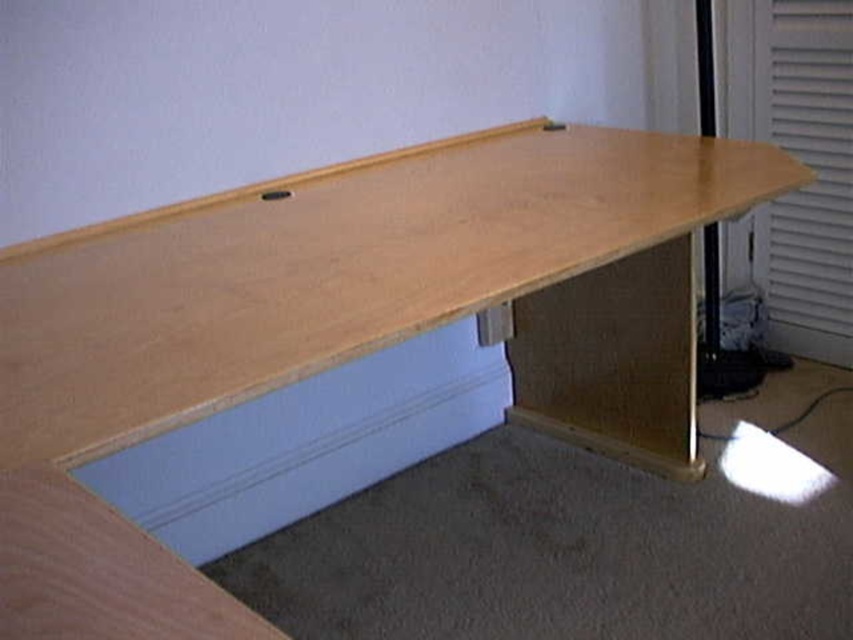
Locate an element on the screen. The image size is (853, 640). light blue plastic drawer at lower center is located at coordinates (305, 444).

Is light blue plastic drawer at lower center to the right of white textured blind at right from the viewer's perspective?

Incorrect, light blue plastic drawer at lower center is not on the right side of white textured blind at right.

This screenshot has width=853, height=640. I want to click on light blue plastic drawer at lower center, so click(305, 444).